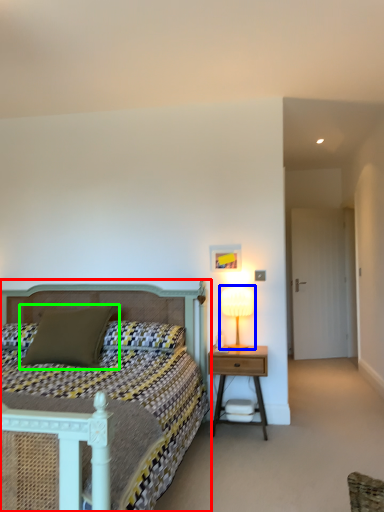
Question: Which is nearer to the bed (highlighted by a red box)? table lamp (highlighted by a blue box) or pillow (highlighted by a green box).

Choices:
 (A) table lamp
 (B) pillow

Answer: (B)